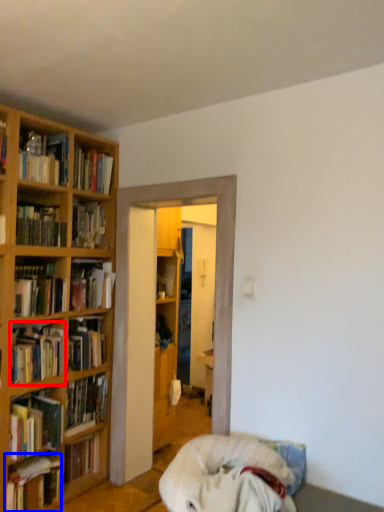
Question: Which of the following is the closest to the observer, book (highlighted by a red box) or book (highlighted by a blue box)?

Choices:
 (A) book
 (B) book

Answer: (B)